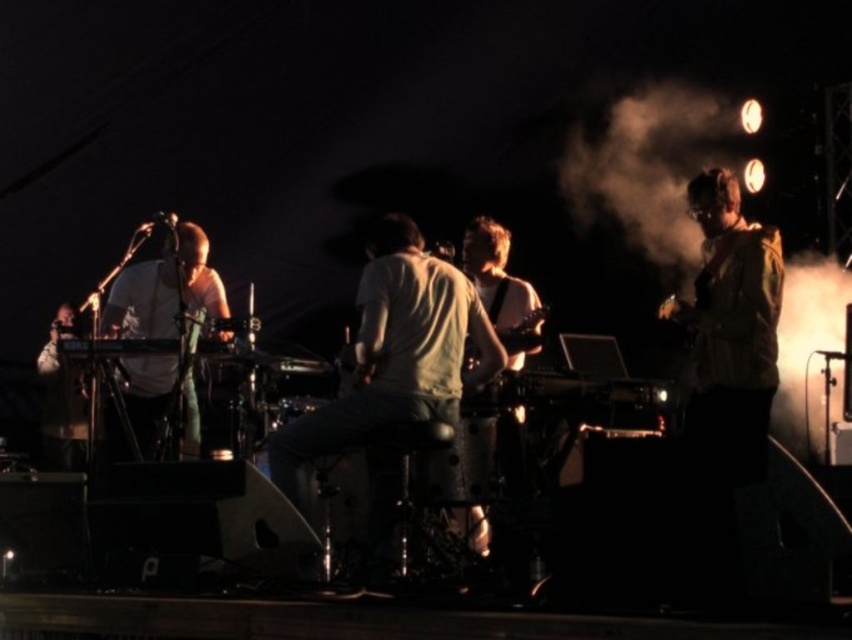
You are a photographer at the back of the stage. You want to capture a clear shot of the matte white keyboard at left without the white fog at right obstructing the view. Which direction should you move to avoid the fog?

You should move to the left side to avoid the white fog at right, as the white fog at right is positioned on the right side of the matte white keyboard at left.

You are a photographer trying to capture the drummer and the keyboard player in a single shot. The drummer is at point (x=154, y=420) and the keyboard player is at point (x=49, y=324). Given that you want to focus on the drummer first, which point should you adjust your camera focus to ensure both are in focus?

Since point (x=154, y=420) is closer to the camera than point (x=49, y=324), you should focus on the drummer at point (x=154, y=420) to ensure both are in focus.

You are a stagehand who needs to clear the white fog at right and the white matte keyboard at center. Which object requires more effort to move due to its size?

The white fog at right requires more effort to move because it is larger in size than the white matte keyboard at center.